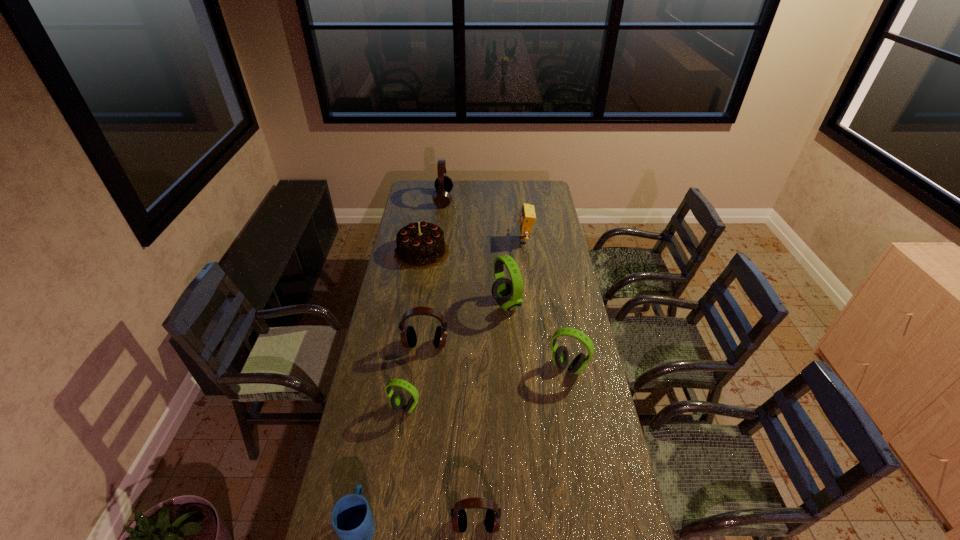
This screenshot has width=960, height=540. I want to click on vacant area situated 0.370m on the face of the sponge, so click(x=445, y=241).

At what (x,y) coordinates should I click in order to perform the action: click on vacant space located on the front of the brown birthday cake. Please return your answer as a coordinate pair (x, y). Looking at the image, I should click on (414, 300).

Locate an element on the screen. This screenshot has width=960, height=540. free region located 0.100m on the front of the leftmost green headset is located at coordinates (399, 444).

I want to click on object positioned at the far edge, so click(x=443, y=184).

The image size is (960, 540). I want to click on birthday cake that is positioned at the left edge, so click(420, 245).

Where is `object that is at the right edge`? The height and width of the screenshot is (540, 960). object that is at the right edge is located at coordinates (560, 356).

Image resolution: width=960 pixels, height=540 pixels. Identify the location of vacant area at the far edge of the desktop. (453, 190).

This screenshot has width=960, height=540. In the image, there is a desktop. In order to click on vacant space at the left edge in this screenshot , I will do `click(325, 537)`.

Find the location of a particular element. The image size is (960, 540). vacant space at the right edge of the desktop is located at coordinates (540, 203).

In the image, there is a desktop. Where is `free space at the far left corner`? free space at the far left corner is located at coordinates (410, 194).